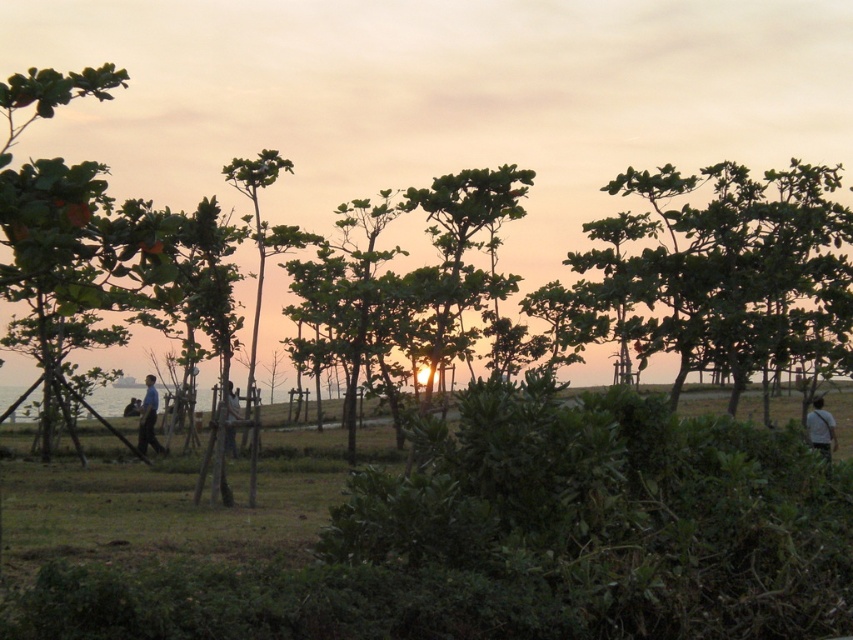
Question: Which point is closer to the camera?

Choices:
 (A) tap(148, 442)
 (B) tap(44, 90)
 (C) tap(227, 426)

Answer: (B)

Question: Considering the relative positions of green matte tree at left and dark blue jeans at center in the image provided, where is green matte tree at left located with respect to dark blue jeans at center?

Choices:
 (A) left
 (B) right

Answer: (A)

Question: Which object appears farthest from the camera in this image?

Choices:
 (A) dark blue jeans at center
 (B) green matte tree at left
 (C) blue fabric shirt at center

Answer: (C)

Question: Is green matte tree at left above light brown fabric shirt at lower right?

Choices:
 (A) no
 (B) yes

Answer: (B)

Question: Does green matte tree at left have a greater width compared to light brown fabric shirt at lower right?

Choices:
 (A) no
 (B) yes

Answer: (B)

Question: Based on their relative distances, which object is nearer to the green matte tree at left?

Choices:
 (A) light brown fabric shirt at lower right
 (B) dark blue jeans at center
 (C) blue fabric shirt at center

Answer: (B)